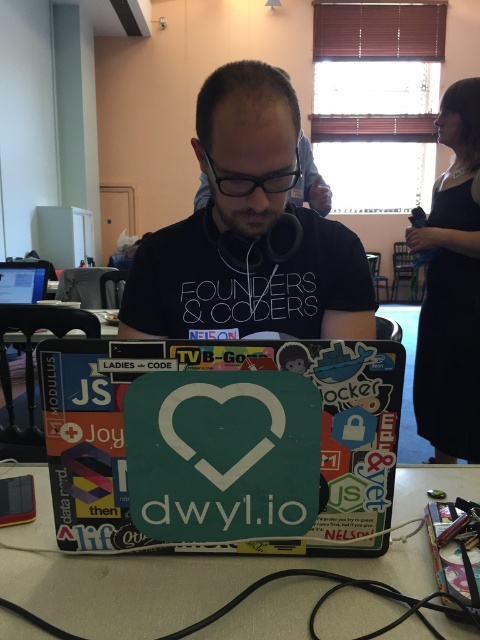
Question: Considering the real-world distances, which object is farthest from the matte black laptop at left?

Choices:
 (A) matte black t-shirt at center
 (B) black dress at right
 (C) matte black table at lower center

Answer: (C)

Question: Which object is positioned farthest from the matte black table at lower center?

Choices:
 (A) matte black laptop at left
 (B) matte black t-shirt at center
 (C) black dress at right

Answer: (A)

Question: Which point is closer to the camera?

Choices:
 (A) matte black laptop at left
 (B) matte black table at lower center
 (C) black dress at right
 (D) matte black t-shirt at center

Answer: (B)

Question: Is matte black t-shirt at center further to camera compared to black dress at right?

Choices:
 (A) yes
 (B) no

Answer: (B)

Question: Is matte black t-shirt at center behind matte black table at lower center?

Choices:
 (A) no
 (B) yes

Answer: (B)

Question: Can you confirm if matte black table at lower center is thinner than black dress at right?

Choices:
 (A) no
 (B) yes

Answer: (A)